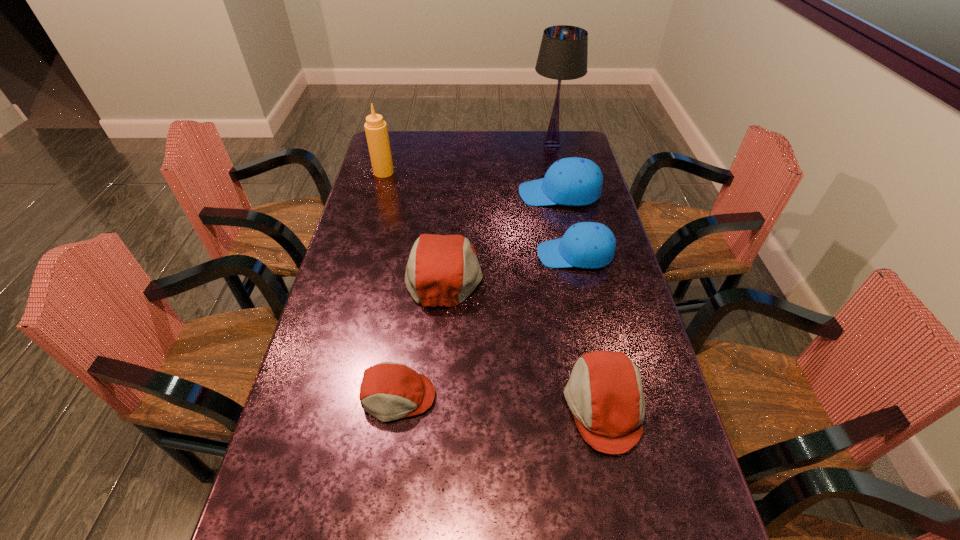
Where is `vacant position in the image that satisfies the following two spatial constraints: 1. on the front-facing side of the bigger blue cap; 2. on the front-facing side of the shortest object`? vacant position in the image that satisfies the following two spatial constraints: 1. on the front-facing side of the bigger blue cap; 2. on the front-facing side of the shortest object is located at coordinates (602, 396).

Locate an element on the screen. The height and width of the screenshot is (540, 960). free space that satisfies the following two spatial constraints: 1. on the front-facing side of the bigger blue cap; 2. on the front-facing side of the smallest red cap is located at coordinates (602, 396).